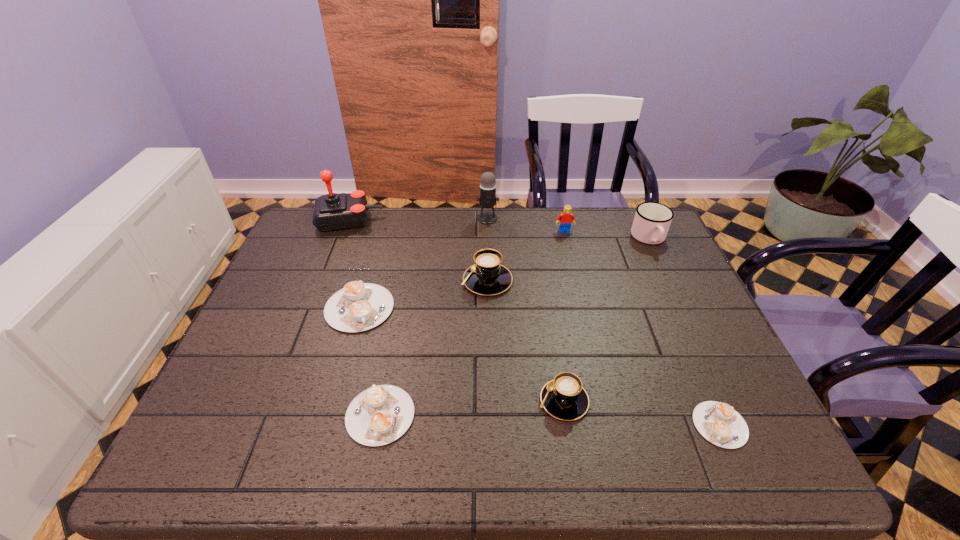
Identify the location of vacant space at the near right corner. Image resolution: width=960 pixels, height=540 pixels. (779, 468).

The image size is (960, 540). In order to click on vacant area that lies between the third shortest object and the microphone in this screenshot , I will do `click(423, 263)`.

This screenshot has height=540, width=960. What are the coordinates of `free point between the eighth tallest object and the farther black cappuccino` in the screenshot? It's located at (434, 348).

Identify the location of vacant region between the third tallest cappuccino and the tallest cappuccino. The image size is (960, 540). (423, 294).

At what (x,y) coordinates should I click in order to perform the action: click on empty location between the red joystick and the third object from right to left. Please return your answer as a coordinate pair (x, y). Looking at the image, I should click on (457, 226).

At what (x,y) coordinates should I click in order to perform the action: click on vacant point located between the gray microphone and the sixth tallest object. Please return your answer as a coordinate pair (x, y). Looking at the image, I should click on (526, 309).

Identify the location of vacant point located between the joystick and the left black cappuccino. (418, 251).

Where is `free space that is in between the fourth tallest cappuccino and the third tallest cappuccino`? This screenshot has height=540, width=960. free space that is in between the fourth tallest cappuccino and the third tallest cappuccino is located at coordinates coord(370,361).

Where is `free spot between the mug and the rightmost cappuccino`? The image size is (960, 540). free spot between the mug and the rightmost cappuccino is located at coordinates (684, 332).

You are a GUI agent. You are given a task and a screenshot of the screen. Output one action in this format:
    pyautogui.click(x=<x>, y=<y>)
    Task: Click on the empty location between the left black cappuccino and the red Lego
    
    Given the screenshot: What is the action you would take?
    pyautogui.click(x=526, y=256)